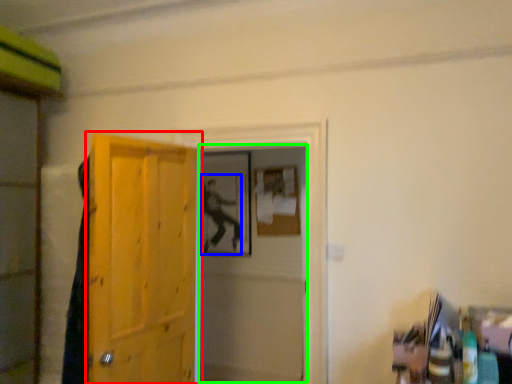
Question: Based on their relative distances, which object is nearer to door (highlighted by a red box)? Choose from person (highlighted by a blue box) and screen door (highlighted by a green box).

Choices:
 (A) person
 (B) screen door

Answer: (B)